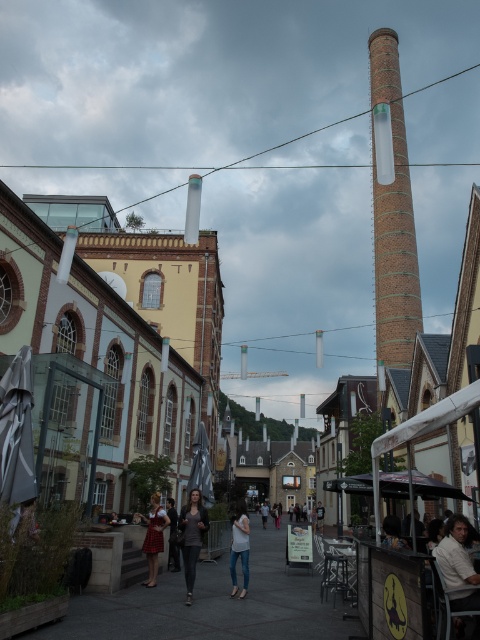
Question: Considering the relative positions of brick chimney at center and denim pants at center in the image provided, where is brick chimney at center located with respect to denim pants at center?

Choices:
 (A) below
 (B) above

Answer: (B)

Question: Which point appears closest to the camera in this image?

Choices:
 (A) (189, 580)
 (B) (432, 552)
 (C) (172, 513)
 (D) (157, 493)

Answer: (B)

Question: Can you confirm if concrete pavement at center is thinner than dark gray fabric pants at center?

Choices:
 (A) yes
 (B) no

Answer: (B)

Question: Which of these objects is positioned closest to the denim pants at center?

Choices:
 (A) red plaid skirt at center
 (B) dark gray fabric pants at center

Answer: (B)

Question: Which of the following is the farthest from the observer?

Choices:
 (A) (264, 509)
 (B) (213, 579)
 (C) (176, 552)
 (D) (151, 500)

Answer: (A)

Question: Is concrete pavement at center positioned at the back of brick chimney at center?

Choices:
 (A) yes
 (B) no

Answer: (B)